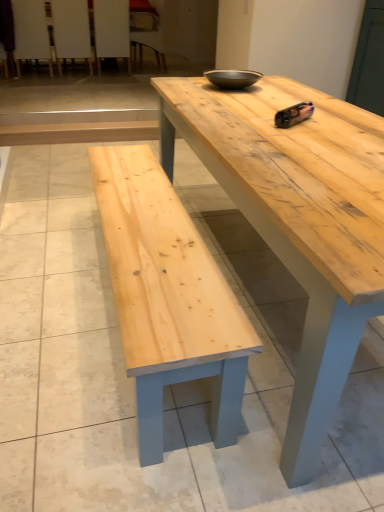
Question: Can you confirm if matte black bowl at center is positioned to the right of wooden chair at upper left, placed as the 3th chair when sorted from right to left?

Choices:
 (A) yes
 (B) no

Answer: (A)

Question: Can you confirm if matte black bowl at center is shorter than wooden chair at upper left, placed as the 3th chair when sorted from right to left?

Choices:
 (A) yes
 (B) no

Answer: (A)

Question: From the image's perspective, is matte black bowl at center over wooden chair at upper left, placed as the second chair when sorted from left to right?

Choices:
 (A) yes
 (B) no

Answer: (B)

Question: Is matte black bowl at center closer to camera compared to wooden chair at upper left, placed as the 3th chair when sorted from right to left?

Choices:
 (A) no
 (B) yes

Answer: (B)

Question: From the image's perspective, is matte black bowl at center under wooden chair at upper left, placed as the 3th chair when sorted from right to left?

Choices:
 (A) no
 (B) yes

Answer: (B)

Question: Can you confirm if matte black bowl at center is taller than wooden chair at upper left, placed as the 3th chair when sorted from right to left?

Choices:
 (A) yes
 (B) no

Answer: (B)

Question: Is natural wood table at center smaller than white wood chair at upper left, the second chair in the right-to-left sequence?

Choices:
 (A) no
 (B) yes

Answer: (A)

Question: Is natural wood table at center to the right of white wood chair at upper left, which is the 3th chair in left-to-right order, from the viewer's perspective?

Choices:
 (A) no
 (B) yes

Answer: (B)

Question: Is natural wood table at center outside white wood chair at upper left, the second chair in the right-to-left sequence?

Choices:
 (A) no
 (B) yes

Answer: (B)

Question: Considering the relative sizes of natural wood table at center and white wood chair at upper left, which is the 3th chair in left-to-right order, in the image provided, is natural wood table at center thinner than white wood chair at upper left, which is the 3th chair in left-to-right order,?

Choices:
 (A) no
 (B) yes

Answer: (A)

Question: Can you confirm if natural wood table at center is shorter than white wood chair at upper left, which is the 3th chair in left-to-right order?

Choices:
 (A) no
 (B) yes

Answer: (B)

Question: Does natural wood table at center come behind white wood chair at upper left, the second chair in the right-to-left sequence?

Choices:
 (A) yes
 (B) no

Answer: (B)

Question: From a real-world perspective, is wooden chair at upper left, the 4th chair from the left, beneath white wood chair at upper left, the second chair in the right-to-left sequence?

Choices:
 (A) yes
 (B) no

Answer: (A)